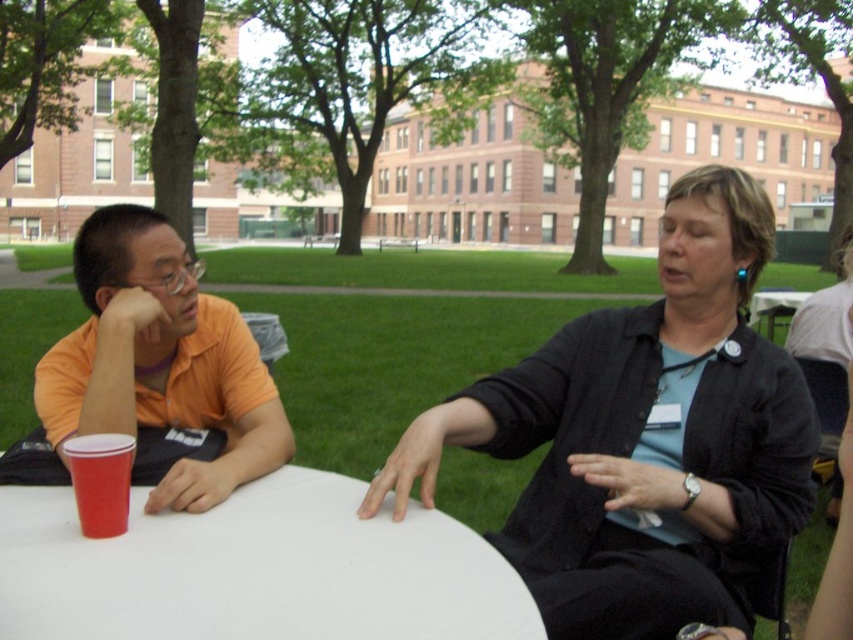
Is point (677, 184) positioned behind point (102, 336)?

Yes.

Consider the image. Between black fabric jacket at center and orange matte shirt at left, which one has more height?

Standing taller between the two is black fabric jacket at center.

Does point (758, 228) lie behind point (123, 385)?

Yes.

What are the coordinates of `black fabric jacket at center` in the screenshot? It's located at (646, 440).

Between black fabric jacket at center and white smooth table at center, which one is positioned higher?

white smooth table at center is above.

Is black fabric jacket at center below white smooth table at center?

Yes, black fabric jacket at center is below white smooth table at center.

Image resolution: width=853 pixels, height=640 pixels. I want to click on black fabric jacket at center, so click(646, 440).

The width and height of the screenshot is (853, 640). I want to click on black fabric jacket at center, so click(646, 440).

Between black fabric jacket at center and matte plastic cup at table left, which one appears on the right side from the viewer's perspective?

black fabric jacket at center is more to the right.

Is point (627, 572) positioned in front of point (93, 493)?

No, (627, 572) is further to viewer.

Find the location of a particular element. The image size is (853, 640). black fabric jacket at center is located at coordinates (x=646, y=440).